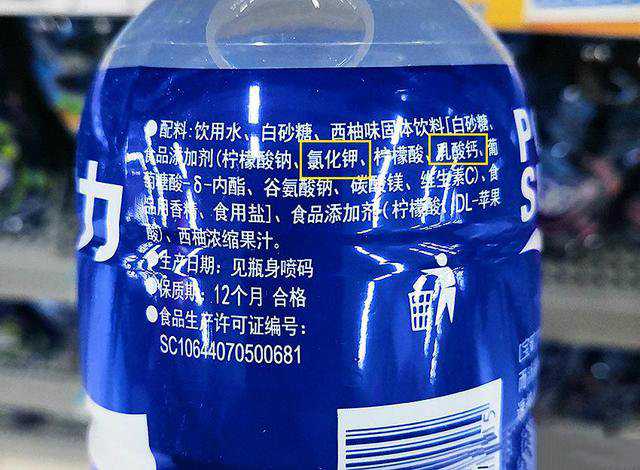
I want to click on white metal store shelves, so click(x=570, y=449), click(x=50, y=441), click(x=54, y=380), click(x=586, y=286), click(x=41, y=267).